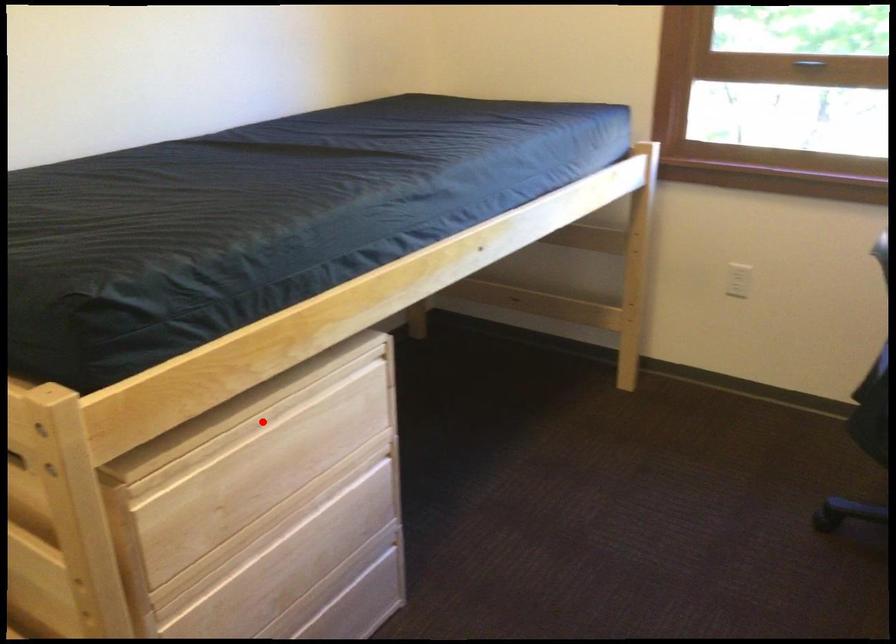
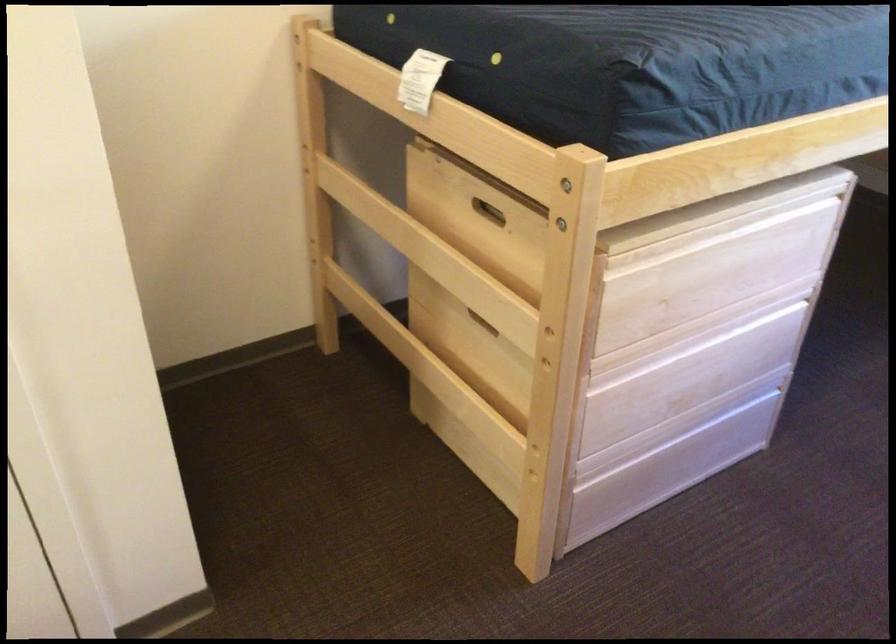
The point at the highlighted location is marked in the first image. Where is the corresponding point in the second image?

(720, 230)